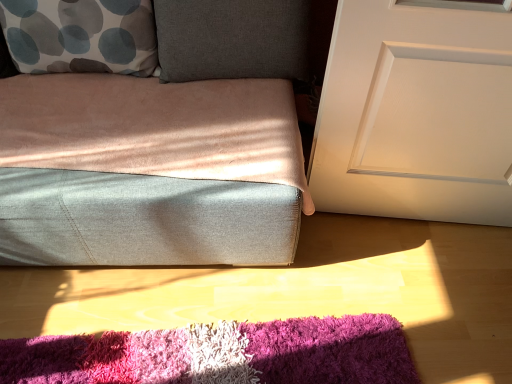
The height and width of the screenshot is (384, 512). I want to click on vacant space underneath white matte door at right (from a real-world perspective), so click(407, 223).